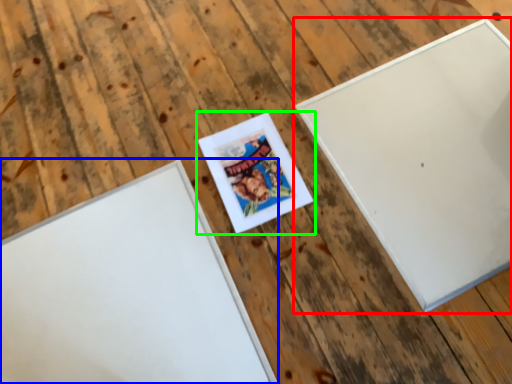
Question: Which is farther away from picture frame (highlighted by a red box)? picture frame (highlighted by a blue box) or picture frame (highlighted by a green box)?

Choices:
 (A) picture frame
 (B) picture frame

Answer: (A)